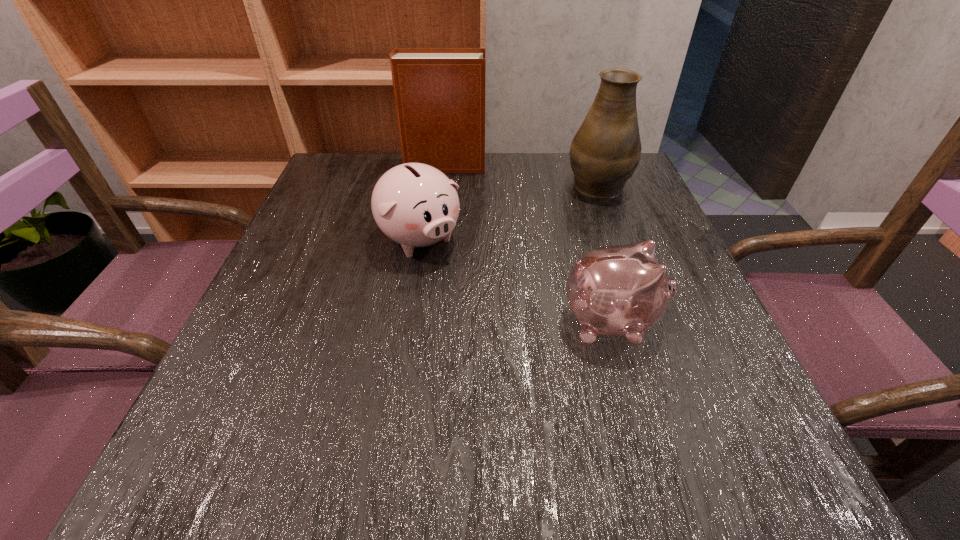
Image resolution: width=960 pixels, height=540 pixels. What are the coordinates of `unoccupied area between the hardback book and the right piggy bank` in the screenshot? It's located at (527, 244).

Find the location of a particular element. This screenshot has width=960, height=540. free spot between the third farthest object and the pitcher is located at coordinates (509, 211).

The width and height of the screenshot is (960, 540). What are the coordinates of `free area in between the hardback book and the nearer piggy bank` in the screenshot? It's located at (527, 244).

Where is `vacant area between the hardback book and the nearest object`? vacant area between the hardback book and the nearest object is located at coordinates (527, 244).

This screenshot has width=960, height=540. In order to click on free space that is in between the nearer piggy bank and the hardback book in this screenshot , I will do `click(527, 244)`.

You are a GUI agent. You are given a task and a screenshot of the screen. Output one action in this format:
    pyautogui.click(x=<x>, y=<y>)
    Task: Click on the empty space between the pitcher and the hardback book
    This screenshot has width=960, height=540.
    Given the screenshot: What is the action you would take?
    pyautogui.click(x=520, y=174)

Find the location of `object that is the third closest to the hardback book`. object that is the third closest to the hardback book is located at coordinates (622, 290).

Select which object is the closest to the pitcher. Please provide its 2D coordinates. Your answer should be formatted as a tuple, i.e. [(x, y)], where the tuple contains the x and y coordinates of a point satisfying the conditions above.

[(439, 93)]

Find the location of a particular element. The image size is (960, 540). free space in the image that satisfies the following two spatial constraints: 1. on the handle side of the pitcher; 2. on the open cover of the hardback book is located at coordinates (591, 166).

Locate an element on the screen. The height and width of the screenshot is (540, 960). vacant space that satisfies the following two spatial constraints: 1. on the front facing side of the right piggy bank; 2. on the handle side of the pitcher is located at coordinates (571, 183).